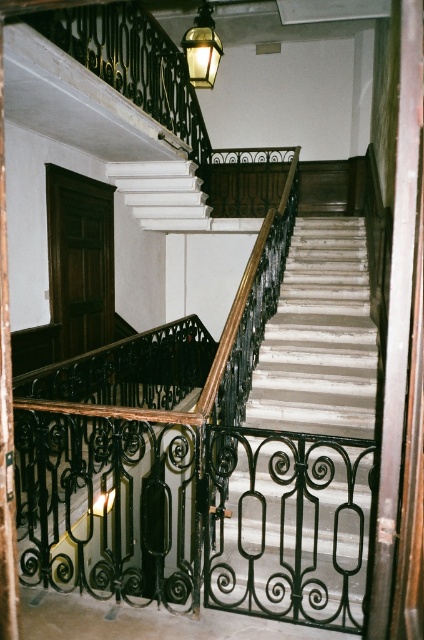
Which of these two, white marble stairs at center or matte brass lantern at upper center, stands shorter?

matte brass lantern at upper center

Describe the element at coordinates (301, 445) in the screenshot. I see `white marble stairs at center` at that location.

What do you see at coordinates (301, 445) in the screenshot?
I see `white marble stairs at center` at bounding box center [301, 445].

Locate an element on the screen. white marble stairs at center is located at coordinates (301, 445).